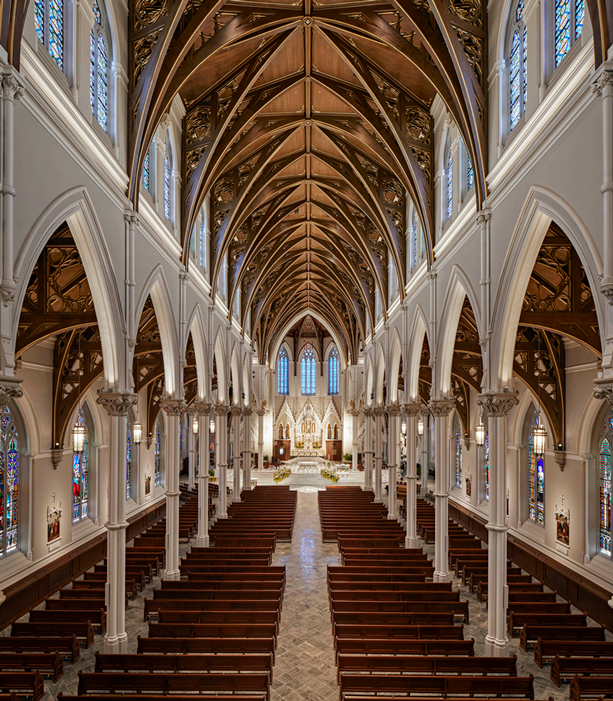
Find the location of a particular element. This screenshot has width=613, height=701. floor is located at coordinates (318, 606).